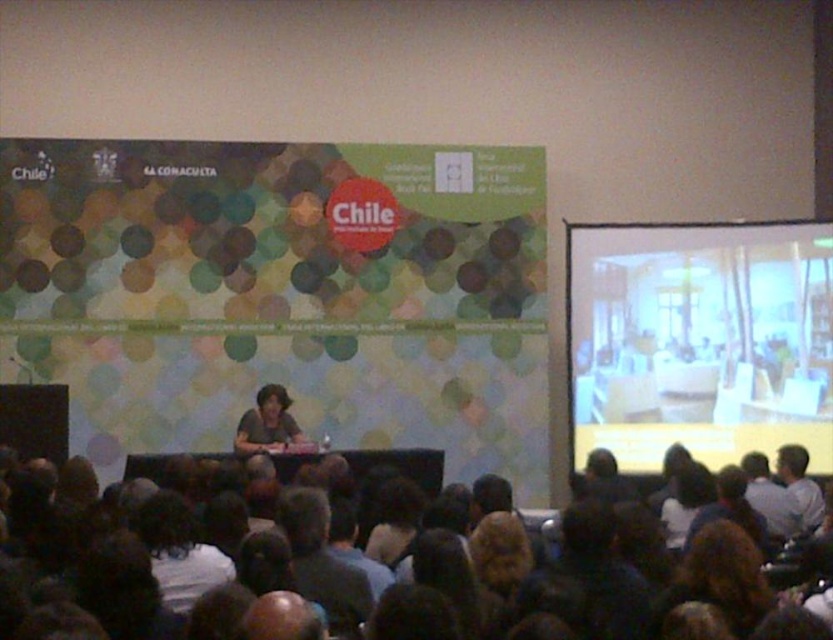
Question: Does brown hair at lower right have a lesser width compared to dark gray shirt at center?

Choices:
 (A) yes
 (B) no

Answer: (B)

Question: Which point is farther from the camera taking this photo?

Choices:
 (A) (338, 604)
 (B) (749, 461)
 (C) (787, 467)
 (D) (252, 417)

Answer: (D)

Question: Can you confirm if dark hair at center is positioned above matte black shirt at center?

Choices:
 (A) yes
 (B) no

Answer: (B)

Question: Which point is closer to the camera?

Choices:
 (A) (609, 333)
 (B) (212, 620)
 (C) (293, 582)

Answer: (B)

Question: Among these objects, which one is farthest from the camera?

Choices:
 (A) white shirt at lower right
 (B) dark hair at center
 (C) matte white screen at right

Answer: (C)

Question: Considering the relative positions of light blue shirt at lower right and white shirt at lower right in the image provided, where is light blue shirt at lower right located with respect to white shirt at lower right?

Choices:
 (A) below
 (B) above

Answer: (A)